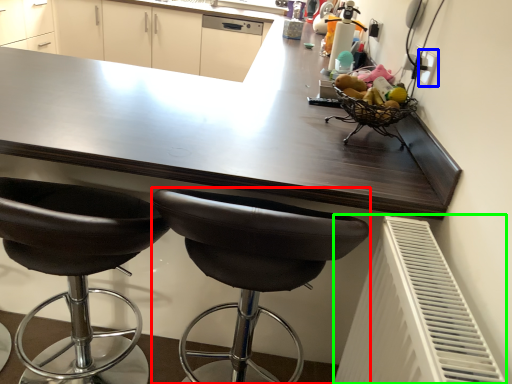
Question: Which object is the farthest from chair (highlighted by a red box)? Choose among these: electric outlet (highlighted by a blue box) or radiator (highlighted by a green box).

Choices:
 (A) electric outlet
 (B) radiator

Answer: (A)